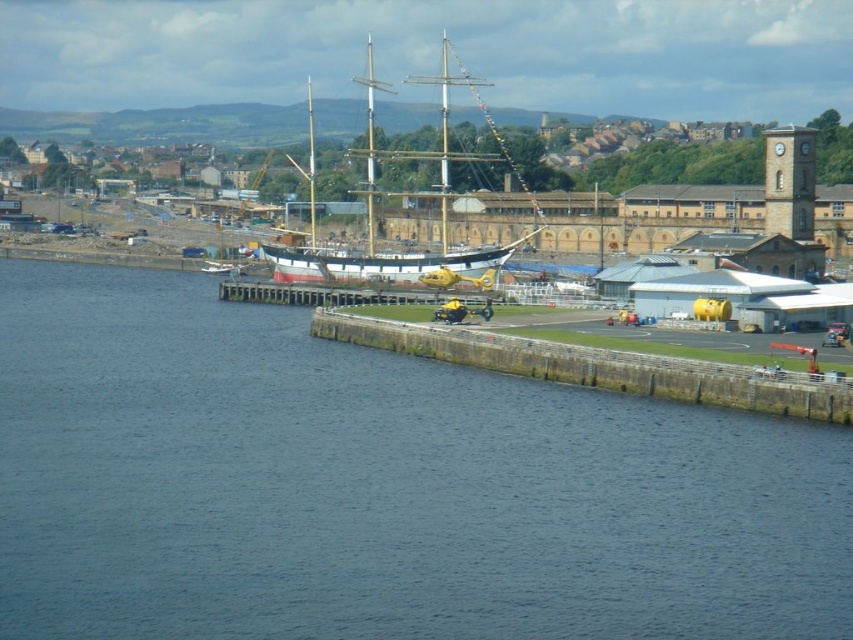
From the picture: You are standing on the dock and looking towards the blue water at lower left and the white wooden ship at center. Which object is located lower in the scene?

The blue water at lower left is located below the white wooden ship at center, so it is lower in the scene.

You are planning to transport a large sculpture that is 10 meters wide. You have access to both the white wooden ship at center and the yellow matte helicopter at center. Based on their sizes, which one can accommodate the sculpture?

The white wooden ship at center has a larger width than the yellow matte helicopter at center, so the sculpture can be accommodated on the white wooden ship at center.

You are a photographer planning to capture the white wooden ship at center and the blue water at lower left in a single frame. Based on their sizes in the image, which one will occupy more of the frame?

The white wooden ship at center occupies more space than the blue water at lower left in the image, so it will take up more of the frame.